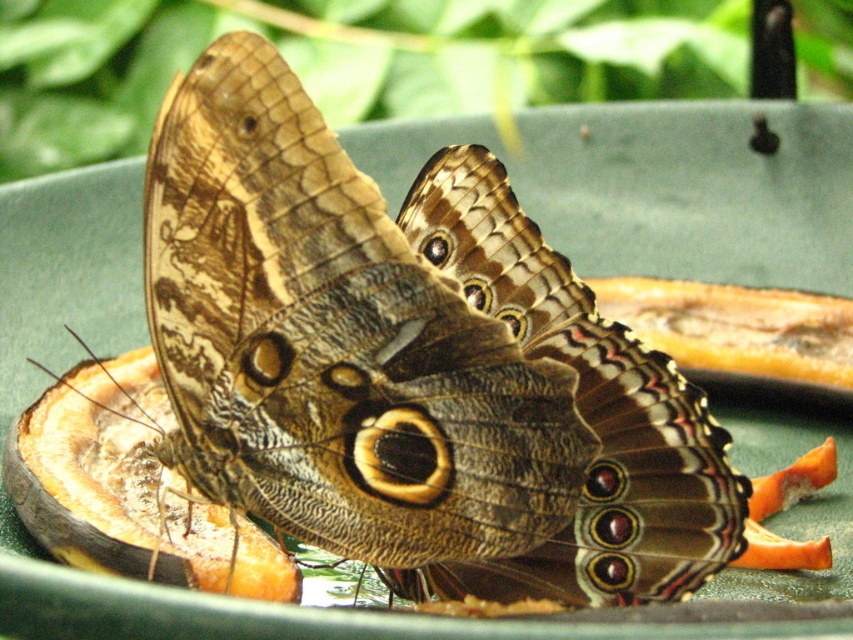
You are a scientist observing a brown textured butterfly at center and a smooth orange peel at center in a container. Which object takes up more space in the container?

The smooth orange peel at center takes up more space in the container because the brown textured butterfly at center is smaller than it.

You are a gardener who wants to protect the fruit from pests. You see a brown textured butterfly at center and a smooth orange peel at center. Which object is directly above the other?

The brown textured butterfly at center is positioned over smooth orange peel at center, so the butterfly is directly above the orange peel.